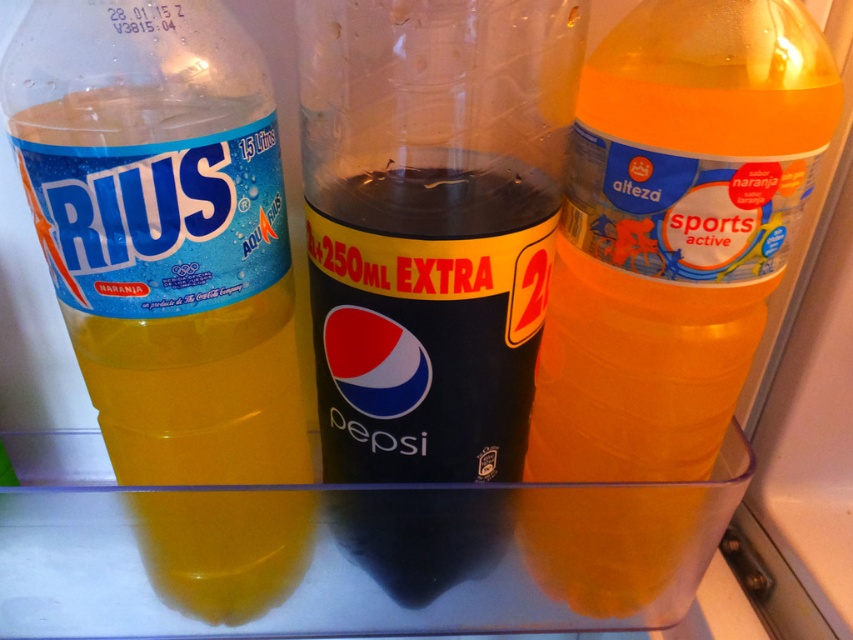
Does point (241, 506) come closer to viewer compared to point (477, 390)?

No, it is not.

Is point (234, 61) behind point (498, 500)?

No, it is not.

Find the location of a particular element. translucent plastic bottle at left is located at coordinates (163, 232).

Is translucent plastic bottle at left above translucent orange bottle at right?

Correct, translucent plastic bottle at left is located above translucent orange bottle at right.

Is point (221, 440) farther from camera compared to point (735, 33)?

Yes, point (221, 440) is behind point (735, 33).

Where is `translucent plastic bottle at left`? translucent plastic bottle at left is located at coordinates (163, 232).

Is black plastic pepsi bottle at center shorter than translucent orange bottle at right?

Yes, black plastic pepsi bottle at center is shorter than translucent orange bottle at right.

Who is higher up, black plastic pepsi bottle at center or translucent orange bottle at right?

black plastic pepsi bottle at center is above.

Which is behind, point (426, 65) or point (605, 356)?

Positioned behind is point (605, 356).

Find the location of a particular element. Image resolution: width=853 pixels, height=640 pixels. black plastic pepsi bottle at center is located at coordinates (431, 225).